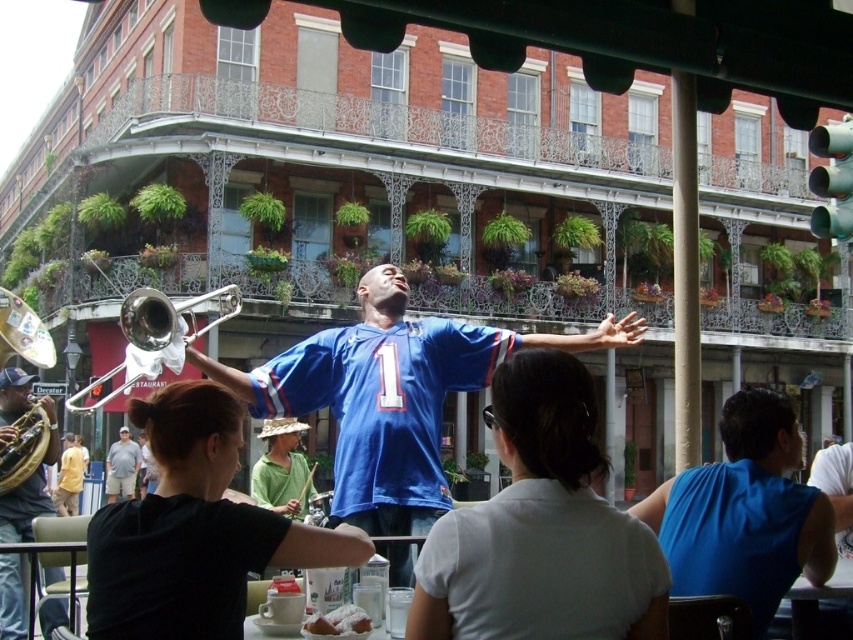
Question: Based on their relative distances, which object is nearer to the khaki shorts at lower left?

Choices:
 (A) blue sleeveless shirt at right
 (B) blue jersey at center
 (C) gold brass trombone at center

Answer: (C)

Question: Does blue sleeveless shirt at right appear on the left side of yellow cotton shirt at lower left?

Choices:
 (A) yes
 (B) no

Answer: (B)

Question: Which of the following is the farthest from the observer?

Choices:
 (A) blue sleeveless shirt at right
 (B) shiny brass trumpet at left

Answer: (B)

Question: Where is blue jersey at center located in relation to shiny brass trumpet at left in the image?

Choices:
 (A) above
 (B) below

Answer: (B)

Question: Which of the following is the closest to the observer?

Choices:
 (A) click(x=741, y=461)
 (B) click(x=65, y=513)
 (C) click(x=405, y=349)

Answer: (A)

Question: Is blue sleeveless shirt at right bigger than yellow cotton shirt at lower left?

Choices:
 (A) yes
 (B) no

Answer: (A)